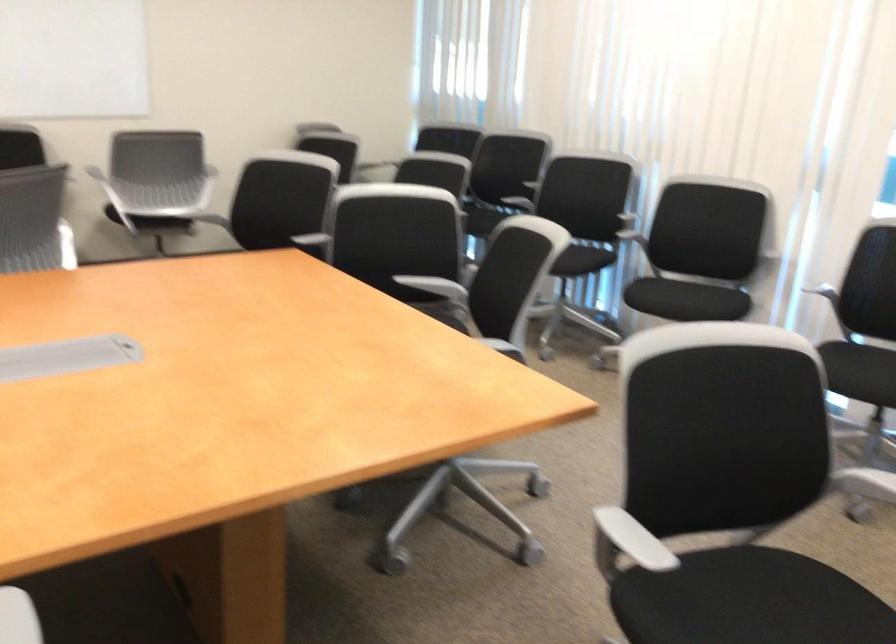
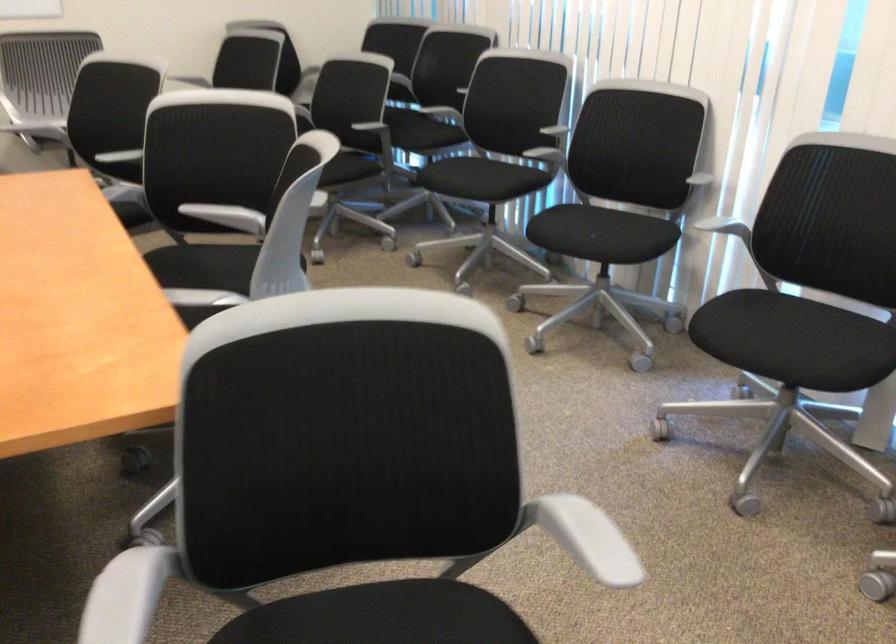
Find the pixel in the second image that matches [415,283] in the first image.

(208, 212)